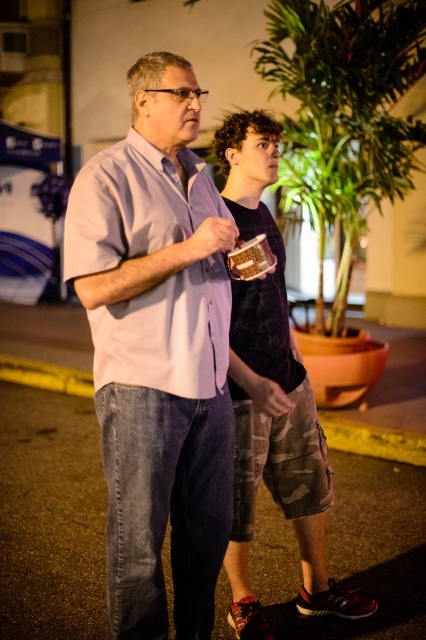
Question: Can you confirm if light purple cotton shirt at center is positioned to the right of dark blue t-shirt at center?

Choices:
 (A) yes
 (B) no

Answer: (B)

Question: Is light purple cotton shirt at center smaller than dark blue t-shirt at center?

Choices:
 (A) no
 (B) yes

Answer: (B)

Question: Which of the following is the farthest from the observer?

Choices:
 (A) light purple cotton shirt at center
 (B) dark blue t-shirt at center

Answer: (B)

Question: Which object is farther from the camera taking this photo?

Choices:
 (A) dark blue t-shirt at center
 (B) light purple cotton shirt at center

Answer: (A)

Question: Does light purple cotton shirt at center come behind dark blue t-shirt at center?

Choices:
 (A) yes
 (B) no

Answer: (B)

Question: Which object is closer to the camera taking this photo?

Choices:
 (A) light purple cotton shirt at center
 (B) dark blue t-shirt at center

Answer: (A)